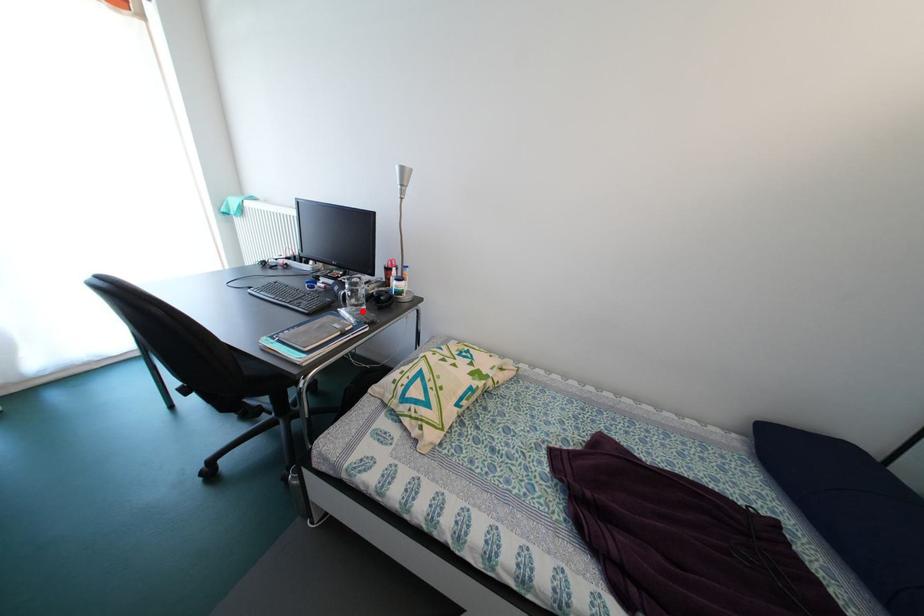
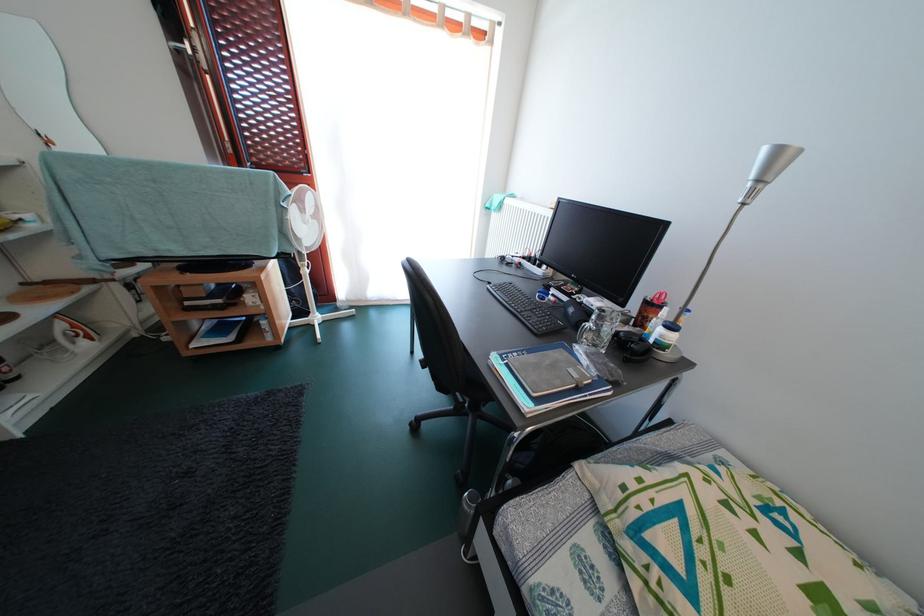
Find the pixel in the second image that matches the highlighted location in the first image.

(602, 351)